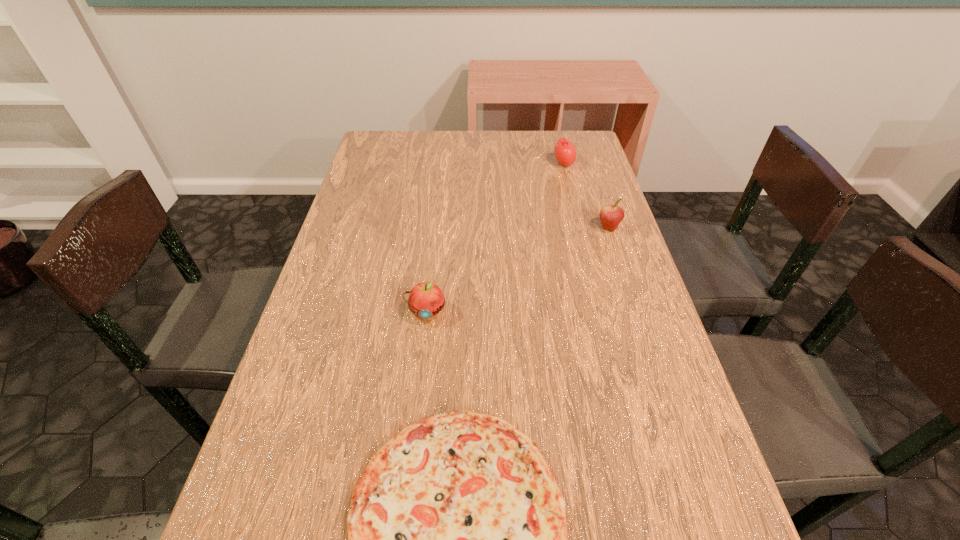
Identify the location of object at the far right corner. (565, 152).

Find the location of a particular element. blank space at the far edge is located at coordinates (508, 151).

Identify the location of vacant space at the left edge of the desktop. The width and height of the screenshot is (960, 540). (309, 389).

I want to click on vacant space at the right edge, so click(659, 323).

In the image, there is a desktop. At what (x,y) coordinates should I click in order to perform the action: click on vacant space at the far left corner. Please return your answer as a coordinate pair (x, y). Looking at the image, I should click on (370, 158).

Identify the location of vacant space at the far right corner. This screenshot has height=540, width=960. (544, 139).

At what (x,y) coordinates should I click in order to perform the action: click on free space between the leftmost apple and the second farthest object. Please return your answer as a coordinate pair (x, y). Image resolution: width=960 pixels, height=540 pixels. Looking at the image, I should click on (517, 270).

You are a GUI agent. You are given a task and a screenshot of the screen. Output one action in this format:
    pyautogui.click(x=<x>, y=<y>)
    Task: Click on the vacant space that's between the rightmost apple and the second apple from right to left
    The width and height of the screenshot is (960, 540).
    Given the screenshot: What is the action you would take?
    pyautogui.click(x=587, y=195)

I want to click on vacant space in between the second nearest object and the third object from left to right, so click(495, 238).

Where is `vacant point located between the third farthest object and the rightmost apple`? This screenshot has height=540, width=960. vacant point located between the third farthest object and the rightmost apple is located at coordinates (517, 270).